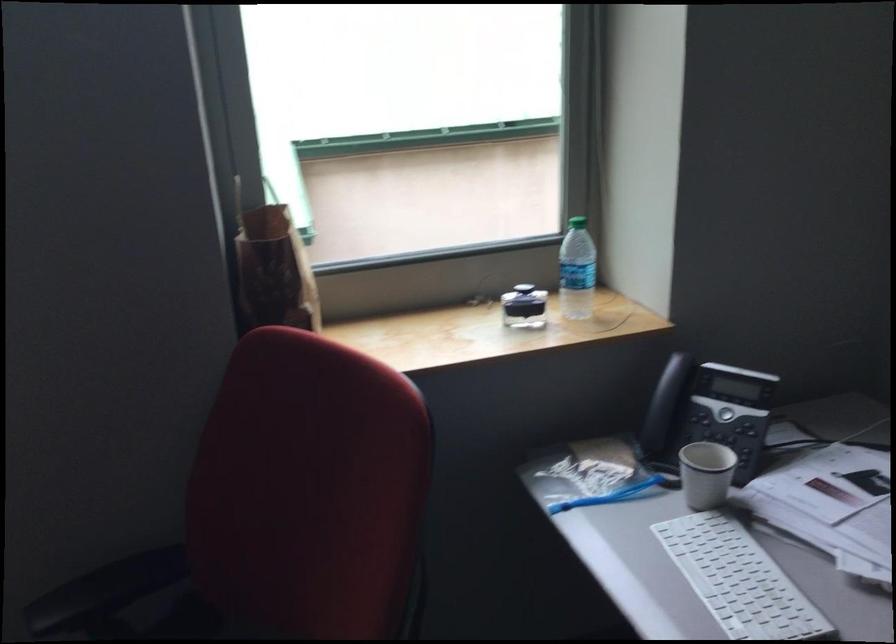
Find where to lift the telephone handset. Please return your answer as a coordinate pair (x, y).

(707, 413)